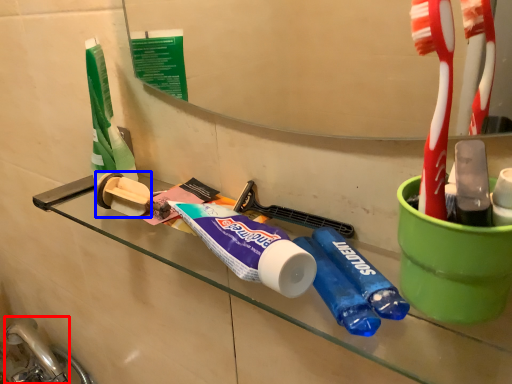
Question: Among these objects, which one is farthest to the camera, faucet (highlighted by a red box) or toilet paper (highlighted by a blue box)?

Choices:
 (A) faucet
 (B) toilet paper

Answer: (A)